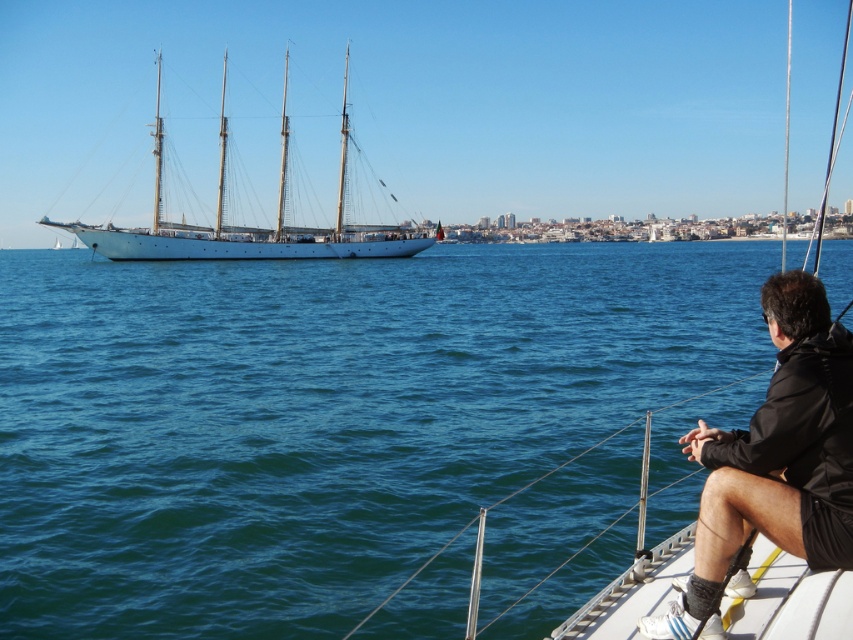
Between black matte jacket at lower right and white polished wood sailboat at left, which one has less height?

black matte jacket at lower right

Who is positioned more to the right, black matte jacket at lower right or white polished wood sailboat at left?

From the viewer's perspective, black matte jacket at lower right appears more on the right side.

Locate an element on the screen. The height and width of the screenshot is (640, 853). black matte jacket at lower right is located at coordinates (775, 460).

Is white matte sailboat at left above white polished wood sailboat at left?

No.

Does white matte sailboat at left have a smaller size compared to white polished wood sailboat at left?

Incorrect, white matte sailboat at left is not smaller in size than white polished wood sailboat at left.

The height and width of the screenshot is (640, 853). In order to click on white matte sailboat at left in this screenshot , I will do `click(628, 586)`.

Is black matte jacket at lower right above white matte sailboat at left?

Incorrect, black matte jacket at lower right is not positioned above white matte sailboat at left.

Between black matte jacket at lower right and white matte sailboat at left, which one has less height?

With less height is black matte jacket at lower right.

Is point (793, 545) positioned before point (746, 634)?

Yes.

Identify the location of black matte jacket at lower right. Image resolution: width=853 pixels, height=640 pixels. (775, 460).